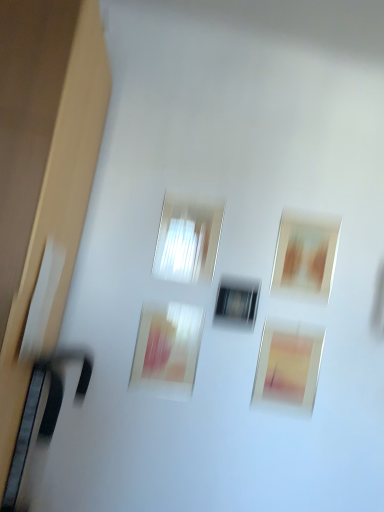
How much space does transparent glass window at center, marked as the second window in a left-to-right arrangement, occupy vertically?

6.93 inches.

What do you see at coordinates (167, 350) in the screenshot? The image size is (384, 512). I see `matte pink painting at center, the first picture frame when ordered from left to right` at bounding box center [167, 350].

Describe the element at coordinates (305, 256) in the screenshot. I see `matte brown picture frame at upper right, which ranks as the first picture frame in right-to-left order` at that location.

This screenshot has width=384, height=512. What are the coordinates of `transparent glass window at center, which is the second window from bottom to top` in the screenshot? It's located at (187, 240).

The image size is (384, 512). What do you see at coordinates (187, 240) in the screenshot?
I see `transparent glass window at center, which is the second window in right-to-left order` at bounding box center [187, 240].

This screenshot has height=512, width=384. What do you see at coordinates (288, 368) in the screenshot? I see `matte pink picture frame at lower center, which is the second picture frame in right-to-left order` at bounding box center [288, 368].

I want to click on transparent glass window at center, marked as the second window in a left-to-right arrangement, so click(237, 303).

In terms of width, does transparent glass window at center, arranged as the 1th window when viewed from the top, look wider or thinner when compared to matte brown picture frame at upper right, which ranks as the first picture frame in right-to-left order?

Clearly, transparent glass window at center, arranged as the 1th window when viewed from the top, has more width compared to matte brown picture frame at upper right, which ranks as the first picture frame in right-to-left order.

Is transparent glass window at center, which is the second window in right-to-left order, positioned before matte brown picture frame at upper right, the 3th picture frame in the left-to-right sequence?

That is True.

You are a GUI agent. You are given a task and a screenshot of the screen. Output one action in this format:
    pyautogui.click(x=<x>, y=<y>)
    Task: Click on the 2nd picture frame behind the transparent glass window at center, which is the second window in right-to-left order
    The image size is (384, 512).
    Given the screenshot: What is the action you would take?
    pyautogui.click(x=305, y=256)

Is transparent glass window at center, which is the second window from bottom to top, situated inside matte brown picture frame at upper right, which ranks as the first picture frame in right-to-left order, or outside?

transparent glass window at center, which is the second window from bottom to top, is not inside matte brown picture frame at upper right, which ranks as the first picture frame in right-to-left order, it's outside.

Which object is positioned more to the right, matte pink painting at center, the first picture frame when ordered from left to right, or transparent glass window at center, the 1th window positioned from the bottom?

From the viewer's perspective, transparent glass window at center, the 1th window positioned from the bottom, appears more on the right side.

Is matte pink painting at center, the first picture frame when ordered from left to right, oriented towards transparent glass window at center, arranged as the first window when viewed from the right?

No, matte pink painting at center, the first picture frame when ordered from left to right, does not turn towards transparent glass window at center, arranged as the first window when viewed from the right.

Can you confirm if matte pink painting at center, marked as the 3th picture frame in a right-to-left arrangement, is shorter than transparent glass window at center, arranged as the first window when viewed from the right?

No, matte pink painting at center, marked as the 3th picture frame in a right-to-left arrangement, is not shorter than transparent glass window at center, arranged as the first window when viewed from the right.

Which of these two, matte pink painting at center, the first picture frame when ordered from left to right, or matte pink picture frame at lower center, which is the second picture frame in right-to-left order, is thinner?

Thinner between the two is matte pink painting at center, the first picture frame when ordered from left to right.

How distant is matte pink painting at center, marked as the 3th picture frame in a right-to-left arrangement, from matte pink picture frame at lower center, which is the 2th picture frame in left-to-right order?

A distance of 13.94 inches exists between matte pink painting at center, marked as the 3th picture frame in a right-to-left arrangement, and matte pink picture frame at lower center, which is the 2th picture frame in left-to-right order.

What are the coordinates of `picture frame below the matte pink painting at center, the first picture frame when ordered from left to right (from the image's perspective)` in the screenshot? It's located at (x=288, y=368).

Does matte pink painting at center, the first picture frame when ordered from left to right, contain matte pink picture frame at lower center, which is the 2th picture frame in left-to-right order?

That's incorrect, matte pink picture frame at lower center, which is the 2th picture frame in left-to-right order, is not inside matte pink painting at center, the first picture frame when ordered from left to right.

Is transparent glass window at center, the 1th window positioned from the bottom, beside matte pink picture frame at lower center, which is the second picture frame in right-to-left order?

No, transparent glass window at center, the 1th window positioned from the bottom, is not touching matte pink picture frame at lower center, which is the second picture frame in right-to-left order.

From the picture: Is matte pink picture frame at lower center, which is the 2th picture frame in left-to-right order, at the back of transparent glass window at center, marked as the second window in a left-to-right arrangement?

transparent glass window at center, marked as the second window in a left-to-right arrangement, is not turned away from matte pink picture frame at lower center, which is the 2th picture frame in left-to-right order.

Which is behind, point (240, 292) or point (288, 397)?

The point (240, 292) is farther from the camera.

Looking at this image, from a real-world perspective, is transparent glass window at center, arranged as the first window when viewed from the right, positioned over matte pink picture frame at lower center, which is the second picture frame in right-to-left order, based on gravity?

Correct, in the physical world, transparent glass window at center, arranged as the first window when viewed from the right, is higher than matte pink picture frame at lower center, which is the second picture frame in right-to-left order.

Would you say transparent glass window at center, positioned as the second window in top-to-bottom order, is part of matte pink picture frame at lower center, which is the 2th picture frame in left-to-right order,'s contents?

No, transparent glass window at center, positioned as the second window in top-to-bottom order, is located outside of matte pink picture frame at lower center, which is the 2th picture frame in left-to-right order.

Between matte pink picture frame at lower center, which is the second picture frame in right-to-left order, and transparent glass window at center, the 1th window positioned from the bottom, which one appears on the left side from the viewer's perspective?

Positioned to the left is transparent glass window at center, the 1th window positioned from the bottom.

This screenshot has width=384, height=512. What are the coordinates of `the 1st picture frame below the transparent glass window at center, the 1th window positioned from the bottom (from a real-world perspective)` in the screenshot? It's located at (288, 368).

In terms of width, does matte pink picture frame at lower center, which is the 2th picture frame in left-to-right order, look wider or thinner when compared to transparent glass window at center, arranged as the first window when viewed from the right?

matte pink picture frame at lower center, which is the 2th picture frame in left-to-right order, is thinner than transparent glass window at center, arranged as the first window when viewed from the right.

From the picture: Considering the relative sizes of matte pink picture frame at lower center, which is the second picture frame in right-to-left order, and matte brown picture frame at upper right, the 3th picture frame in the left-to-right sequence, in the image provided, is matte pink picture frame at lower center, which is the second picture frame in right-to-left order, bigger than matte brown picture frame at upper right, the 3th picture frame in the left-to-right sequence,?

Yes, matte pink picture frame at lower center, which is the second picture frame in right-to-left order, is bigger than matte brown picture frame at upper right, the 3th picture frame in the left-to-right sequence.

Considering the positions of objects matte pink picture frame at lower center, which is the second picture frame in right-to-left order, and matte brown picture frame at upper right, which ranks as the first picture frame in right-to-left order, in the image provided, who is in front, matte pink picture frame at lower center, which is the second picture frame in right-to-left order, or matte brown picture frame at upper right, which ranks as the first picture frame in right-to-left order,?

matte pink picture frame at lower center, which is the second picture frame in right-to-left order, is closer to the camera.

Which of these two, matte pink picture frame at lower center, which is the 2th picture frame in left-to-right order, or matte brown picture frame at upper right, the 3th picture frame in the left-to-right sequence, is thinner?

matte brown picture frame at upper right, the 3th picture frame in the left-to-right sequence, is thinner.

Does matte brown picture frame at upper right, which ranks as the first picture frame in right-to-left order, have a smaller size compared to matte pink painting at center, the first picture frame when ordered from left to right?

Indeed, matte brown picture frame at upper right, which ranks as the first picture frame in right-to-left order, has a smaller size compared to matte pink painting at center, the first picture frame when ordered from left to right.

Considering the positions of objects matte brown picture frame at upper right, the 3th picture frame in the left-to-right sequence, and matte pink painting at center, marked as the 3th picture frame in a right-to-left arrangement, in the image provided, who is more to the right, matte brown picture frame at upper right, the 3th picture frame in the left-to-right sequence, or matte pink painting at center, marked as the 3th picture frame in a right-to-left arrangement,?

Positioned to the right is matte brown picture frame at upper right, the 3th picture frame in the left-to-right sequence.

Is point (303, 292) less distant than point (185, 357)?

No, (303, 292) is behind (185, 357).

Find the location of `the 2nd picture frame behind when counting from the transparent glass window at center, which is the second window in right-to-left order`. the 2nd picture frame behind when counting from the transparent glass window at center, which is the second window in right-to-left order is located at coordinates (305, 256).

Image resolution: width=384 pixels, height=512 pixels. What are the coordinates of `picture frame that is the 2nd one below the transparent glass window at center, marked as the second window in a left-to-right arrangement (from a real-world perspective)` in the screenshot? It's located at (167, 350).

When comparing their distances from matte brown picture frame at upper right, which ranks as the first picture frame in right-to-left order, does matte pink picture frame at lower center, which is the 2th picture frame in left-to-right order, or transparent glass window at center, arranged as the 1th window when viewed from the top, seem closer?

Based on the image, matte pink picture frame at lower center, which is the 2th picture frame in left-to-right order, appears to be nearer to matte brown picture frame at upper right, which ranks as the first picture frame in right-to-left order.

Estimate the real-world distances between objects in this image. Which object is further from transparent glass window at center, positioned as the second window in top-to-bottom order, matte pink painting at center, marked as the 3th picture frame in a right-to-left arrangement, or matte brown picture frame at upper right, which ranks as the first picture frame in right-to-left order?

matte brown picture frame at upper right, which ranks as the first picture frame in right-to-left order, is further to transparent glass window at center, positioned as the second window in top-to-bottom order.

From the image, which object appears to be nearer to transparent glass window at center, arranged as the 1th window when viewed from the top, matte pink painting at center, marked as the 3th picture frame in a right-to-left arrangement, or transparent glass window at center, positioned as the second window in top-to-bottom order?

The object closer to transparent glass window at center, arranged as the 1th window when viewed from the top, is transparent glass window at center, positioned as the second window in top-to-bottom order.

When comparing their distances from matte pink painting at center, the first picture frame when ordered from left to right, does matte brown picture frame at upper right, the 3th picture frame in the left-to-right sequence, or transparent glass window at center, arranged as the first window when viewed from the right, seem closer?

Among the two, transparent glass window at center, arranged as the first window when viewed from the right, is located nearer to matte pink painting at center, the first picture frame when ordered from left to right.

Which object lies further to the anchor point transparent glass window at center, which is the second window from bottom to top, matte brown picture frame at upper right, which ranks as the first picture frame in right-to-left order, or matte pink painting at center, marked as the 3th picture frame in a right-to-left arrangement?

matte brown picture frame at upper right, which ranks as the first picture frame in right-to-left order, is positioned further to the anchor transparent glass window at center, which is the second window from bottom to top.

Estimate the real-world distances between objects in this image. Which object is further from matte pink painting at center, marked as the 3th picture frame in a right-to-left arrangement, matte pink picture frame at lower center, which is the second picture frame in right-to-left order, or transparent glass window at center, which is the second window from bottom to top?

Based on the image, matte pink picture frame at lower center, which is the second picture frame in right-to-left order, appears to be further to matte pink painting at center, marked as the 3th picture frame in a right-to-left arrangement.

Looking at the image, which one is located closer to matte pink painting at center, marked as the 3th picture frame in a right-to-left arrangement, matte brown picture frame at upper right, the 3th picture frame in the left-to-right sequence, or transparent glass window at center, which is the second window in right-to-left order?

transparent glass window at center, which is the second window in right-to-left order, lies closer to matte pink painting at center, marked as the 3th picture frame in a right-to-left arrangement, than the other object.

Consider the image. Based on their spatial positions, is matte pink picture frame at lower center, which is the second picture frame in right-to-left order, or matte brown picture frame at upper right, which ranks as the first picture frame in right-to-left order, further from transparent glass window at center, arranged as the first window when viewed from the right?

matte brown picture frame at upper right, which ranks as the first picture frame in right-to-left order, is further to transparent glass window at center, arranged as the first window when viewed from the right.

Identify the location of window between transparent glass window at center, which is the second window in right-to-left order, and matte pink picture frame at lower center, which is the 2th picture frame in left-to-right order, vertically. The height and width of the screenshot is (512, 384). (237, 303).

At what (x,y) coordinates should I click in order to perform the action: click on picture frame between matte pink painting at center, marked as the 3th picture frame in a right-to-left arrangement, and matte brown picture frame at upper right, the 3th picture frame in the left-to-right sequence. Please return your answer as a coordinate pair (x, y). Looking at the image, I should click on (288, 368).

The height and width of the screenshot is (512, 384). I want to click on window between matte brown picture frame at upper right, the 3th picture frame in the left-to-right sequence, and matte pink picture frame at lower center, which is the second picture frame in right-to-left order, vertically, so click(237, 303).

Locate an element on the screen. The height and width of the screenshot is (512, 384). window between transparent glass window at center, which is the second window in right-to-left order, and matte pink painting at center, the first picture frame when ordered from left to right, in the up-down direction is located at coordinates (237, 303).